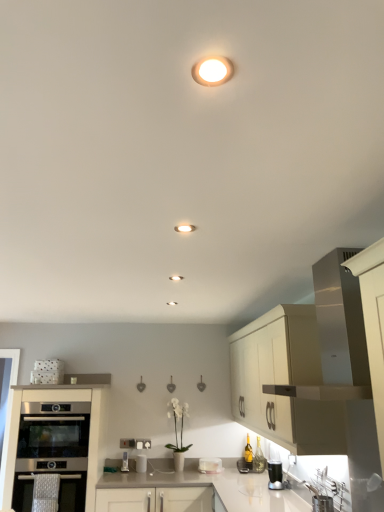
You are a GUI agent. You are given a task and a screenshot of the screen. Output one action in this format:
    pyautogui.click(x=<x>, y=<y>)
    Task: Click on the white glossy countertop at center
    
    Given the screenshot: What is the action you would take?
    pyautogui.click(x=198, y=487)

How much space does matte white light fixture at upper center, the first lighting positioned from the right, occupy vertically?

matte white light fixture at upper center, the first lighting positioned from the right, is 0.45 inches tall.

What do you see at coordinates (141, 463) in the screenshot? I see `white glossy toaster at lower center, which is the second appliance in left-to-right order` at bounding box center [141, 463].

In order to face stainless steel oven at lower left, which is the second oven in top-to-bottom order, should I rotate leftwards or rightwards?

You should look left and rotate roughly 17.743 degrees.

Measure the distance between stainless steel oven at lower left, the 1th oven from the top, and camera.

They are 3.58 meters apart.

You are a GUI agent. You are given a task and a screenshot of the screen. Output one action in this format:
    pyautogui.click(x=<x>, y=<y>)
    Task: Click on the stainless steel oven at lower left, which is the 2th oven in bottom-to-top order
    This screenshot has width=384, height=512.
    Given the screenshot: What is the action you would take?
    pyautogui.click(x=52, y=435)

What do you see at coordinates (320, 497) in the screenshot? The height and width of the screenshot is (512, 384). I see `stainless steel sink at lower right` at bounding box center [320, 497].

The height and width of the screenshot is (512, 384). I want to click on white glossy countertop at center, so click(x=198, y=487).

From the image's perspective, is translucent glass bottle at lower right over white matte cabinet at upper right, the 2th cabinetry in the left-to-right sequence?

No, from the image's perspective, translucent glass bottle at lower right is not over white matte cabinet at upper right, the 2th cabinetry in the left-to-right sequence.

Is translucent glass bottle at lower right to the left of white matte cabinet at upper right, placed as the first cabinetry when sorted from right to left, from the viewer's perspective?

Correct, you'll find translucent glass bottle at lower right to the left of white matte cabinet at upper right, placed as the first cabinetry when sorted from right to left.

From a real-world perspective, is translucent glass bottle at lower right positioned above or below white matte cabinet at upper right, the 2th cabinetry in the left-to-right sequence?

translucent glass bottle at lower right is below white matte cabinet at upper right, the 2th cabinetry in the left-to-right sequence.

Are translucent glass bottle at lower right and white matte cabinet at upper right, the 2th cabinetry in the left-to-right sequence, located far from each other?

translucent glass bottle at lower right is far away from white matte cabinet at upper right, the 2th cabinetry in the left-to-right sequence.

Does stainless steel oven at lower left, the 1th oven from the top, have a larger size compared to stainless steel sink at lower right?

Indeed, stainless steel oven at lower left, the 1th oven from the top, has a larger size compared to stainless steel sink at lower right.

You are a GUI agent. You are given a task and a screenshot of the screen. Output one action in this format:
    pyautogui.click(x=<x>, y=<y>)
    Task: Click on the sink below the stainless steel oven at lower left, which is the 2th oven in bottom-to-top order (from a real-world perspective)
    This screenshot has width=384, height=512.
    Given the screenshot: What is the action you would take?
    pyautogui.click(x=320, y=497)

Looking at their sizes, would you say stainless steel oven at lower left, which is the 2th oven in bottom-to-top order, is wider or thinner than stainless steel sink at lower right?

stainless steel oven at lower left, which is the 2th oven in bottom-to-top order, is wider than stainless steel sink at lower right.

Could you tell me if stainless steel oven at lower left, which is the 2th oven in bottom-to-top order, is facing stainless steel sink at lower right?

No, stainless steel oven at lower left, which is the 2th oven in bottom-to-top order, does not turn towards stainless steel sink at lower right.

From the image's perspective, count 1st lightings upward from the white matte cabinet at upper right, the 2th cabinetry in the left-to-right sequence, and point to it. Please provide its 2D coordinates.

[(185, 228)]

Considering the positions of objects white matte cabinet at upper right, placed as the first cabinetry when sorted from right to left, and matte white recessed light at center, positioned as the 1th lighting in bottom-to-top order, in the image provided, who is more to the right, white matte cabinet at upper right, placed as the first cabinetry when sorted from right to left, or matte white recessed light at center, positioned as the 1th lighting in bottom-to-top order,?

white matte cabinet at upper right, placed as the first cabinetry when sorted from right to left, is more to the right.

Is white matte cabinet at upper right, the 2th cabinetry in the left-to-right sequence, not near matte white recessed light at center, positioned as the 1th lighting in bottom-to-top order?

Yes, white matte cabinet at upper right, the 2th cabinetry in the left-to-right sequence, and matte white recessed light at center, positioned as the 1th lighting in bottom-to-top order, are quite far apart.

Considering the sizes of white matte cabinet at upper right, the 2th cabinetry in the left-to-right sequence, and matte white recessed light at center, which is counted as the 1th lighting, starting from the left, in the image, is white matte cabinet at upper right, the 2th cabinetry in the left-to-right sequence, wider or thinner than matte white recessed light at center, which is counted as the 1th lighting, starting from the left,?

Considering their sizes, white matte cabinet at upper right, the 2th cabinetry in the left-to-right sequence, looks broader than matte white recessed light at center, which is counted as the 1th lighting, starting from the left.

Is stainless steel oven at lower left, the 1th oven in the bottom-to-top sequence, inside the boundaries of white matte cabinet at upper right, the 2th cabinetry in the left-to-right sequence, or outside?

stainless steel oven at lower left, the 1th oven in the bottom-to-top sequence, cannot be found inside white matte cabinet at upper right, the 2th cabinetry in the left-to-right sequence.

Does stainless steel oven at lower left, which is the second oven in top-to-bottom order, turn towards white matte cabinet at upper right, placed as the first cabinetry when sorted from right to left?

No, stainless steel oven at lower left, which is the second oven in top-to-bottom order, is not facing towards white matte cabinet at upper right, placed as the first cabinetry when sorted from right to left.

Which point is more distant from viewer, (59, 489) or (322, 444)?

The point (59, 489) is farther.

Considering the relative sizes of stainless steel oven at lower left, the 1th oven in the bottom-to-top sequence, and white matte cabinet at upper right, placed as the first cabinetry when sorted from right to left, in the image provided, is stainless steel oven at lower left, the 1th oven in the bottom-to-top sequence, wider than white matte cabinet at upper right, placed as the first cabinetry when sorted from right to left,?

Yes.

From the image's perspective, does white glossy countertop at center appear higher than stainless steel sink at lower right?

No, from the image's perspective, white glossy countertop at center is not over stainless steel sink at lower right.

In terms of size, does white glossy countertop at center appear bigger or smaller than stainless steel sink at lower right?

Clearly, white glossy countertop at center is larger in size than stainless steel sink at lower right.

Is point (151, 466) closer to camera compared to point (314, 489)?

No, it is behind (314, 489).

Is stainless steel sink at lower right a part of white glossy countertop at center?

No, stainless steel sink at lower right is located outside of white glossy countertop at center.

From the picture: Does matte white light fixture at upper center, the first lighting positioned from the right, have a smaller size compared to white matte cabinet at upper right, the 2th cabinetry in the left-to-right sequence?

Indeed, matte white light fixture at upper center, the first lighting positioned from the right, has a smaller size compared to white matte cabinet at upper right, the 2th cabinetry in the left-to-right sequence.

Which of these two, matte white light fixture at upper center, which is counted as the second lighting, starting from the back, or white matte cabinet at upper right, the 2th cabinetry in the left-to-right sequence, is wider?

white matte cabinet at upper right, the 2th cabinetry in the left-to-right sequence, is wider.

Based on the photo, is matte white light fixture at upper center, which is counted as the second lighting, starting from the back, not within white matte cabinet at upper right, placed as the first cabinetry when sorted from right to left?

matte white light fixture at upper center, which is counted as the second lighting, starting from the back, is positioned outside white matte cabinet at upper right, placed as the first cabinetry when sorted from right to left.

Which of these two, matte white light fixture at upper center, marked as the 2th lighting in a left-to-right arrangement, or white matte cabinet at upper right, placed as the first cabinetry when sorted from right to left, stands shorter?

matte white light fixture at upper center, marked as the 2th lighting in a left-to-right arrangement, is shorter.

Who is shorter, white glossy toaster at lower center, which is the second appliance in left-to-right order, or matte white recessed light at center, positioned as the second lighting in right-to-left order?

matte white recessed light at center, positioned as the second lighting in right-to-left order.

Which is behind, point (139, 467) or point (185, 231)?

The point (139, 467) is farther.

From the image's perspective, is white glossy toaster at lower center, placed as the 1th appliance when sorted from right to left, below matte white recessed light at center, the 2th lighting from the top?

Correct, white glossy toaster at lower center, placed as the 1th appliance when sorted from right to left, appears lower than matte white recessed light at center, the 2th lighting from the top, in the image.

How much distance is there between white glossy toaster at lower center, placed as the 1th appliance when sorted from right to left, and matte white recessed light at center, positioned as the 1th lighting in bottom-to-top order?

white glossy toaster at lower center, placed as the 1th appliance when sorted from right to left, and matte white recessed light at center, positioned as the 1th lighting in bottom-to-top order, are 10.49 feet apart from each other.

Identify the location of bottle behind the white matte cabinet at upper right, placed as the first cabinetry when sorted from right to left. The width and height of the screenshot is (384, 512). (248, 454).

Where is `sink above the stainless steel oven at lower left, which is the 2th oven in bottom-to-top order (from the image's perspective)`? Image resolution: width=384 pixels, height=512 pixels. sink above the stainless steel oven at lower left, which is the 2th oven in bottom-to-top order (from the image's perspective) is located at coordinates (320, 497).

In the scene shown: Considering their positions, is satin silver oven at lower left, positioned as the second cabinetry in right-to-left order, positioned closer to translucent glass bottle at lower right than metallic silver toaster at lower center, arranged as the second appliance when viewed from the right?

metallic silver toaster at lower center, arranged as the second appliance when viewed from the right.

From the picture: When comparing their distances from translucent glass bottle at lower right, does stainless steel sink at lower right or white matte cabinet at upper right, the 2th cabinetry in the left-to-right sequence, seem further?

white matte cabinet at upper right, the 2th cabinetry in the left-to-right sequence.

When comparing their distances from white glossy countertop at center, does matte white light fixture at upper center, which is the 1th lighting in front-to-back order, or metallic silver toaster at lower center, marked as the 1th appliance in a left-to-right arrangement, seem closer?

metallic silver toaster at lower center, marked as the 1th appliance in a left-to-right arrangement, is closer to white glossy countertop at center.

Looking at this image, from the image, which object appears to be nearer to metallic silver toaster at lower center, arranged as the second appliance when viewed from the right, matte white light fixture at upper center, which is the 1th lighting in front-to-back order, or white glossy countertop at center?

white glossy countertop at center is positioned closer to the anchor metallic silver toaster at lower center, arranged as the second appliance when viewed from the right.

From the image, which object appears to be nearer to matte white light fixture at upper center, marked as the 2th lighting in a left-to-right arrangement, white glossy countertop at center or stainless steel oven at lower left, which is the 2th oven in bottom-to-top order?

white glossy countertop at center is closer to matte white light fixture at upper center, marked as the 2th lighting in a left-to-right arrangement.

When comparing their distances from stainless steel sink at lower right, does satin silver oven at lower left, positioned as the second cabinetry in right-to-left order, or stainless steel oven at lower left, which is the second oven in top-to-bottom order, seem further?

Among the two, satin silver oven at lower left, positioned as the second cabinetry in right-to-left order, is located further to stainless steel sink at lower right.

Looking at the image, which one is located further to stainless steel oven at lower left, which is the second oven in top-to-bottom order, matte white light fixture at upper center, which is the 1th lighting in front-to-back order, or satin silver oven at lower left, positioned as the second cabinetry in right-to-left order?

matte white light fixture at upper center, which is the 1th lighting in front-to-back order, is further to stainless steel oven at lower left, which is the second oven in top-to-bottom order.

From the image, which object appears to be farther from matte white recessed light at center, the 1th lighting when ordered from back to front, matte white light fixture at upper center, marked as the 2th lighting in a left-to-right arrangement, or satin silver oven at lower left, acting as the first cabinetry starting from the left?

satin silver oven at lower left, acting as the first cabinetry starting from the left, is further to matte white recessed light at center, the 1th lighting when ordered from back to front.

You are a GUI agent. You are given a task and a screenshot of the screen. Output one action in this format:
    pyautogui.click(x=<x>, y=<y>)
    Task: Click on the countertop between matte white recessed light at center, arranged as the 2th lighting when viewed from the front, and translucent glass bottle at lower right from front to back
    Image resolution: width=384 pixels, height=512 pixels.
    Given the screenshot: What is the action you would take?
    pyautogui.click(x=198, y=487)

At what (x,y) coordinates should I click in order to perform the action: click on lighting between matte white light fixture at upper center, the first lighting positioned from the right, and stainless steel oven at lower left, the 1th oven in the bottom-to-top sequence, from top to bottom. Please return your answer as a coordinate pair (x, y). The height and width of the screenshot is (512, 384). Looking at the image, I should click on (185, 228).

Find the location of a particular element. This screenshot has height=512, width=384. oven situated between stainless steel oven at lower left, which is the 2th oven in bottom-to-top order, and stainless steel sink at lower right from left to right is located at coordinates (72, 490).

The width and height of the screenshot is (384, 512). Find the location of `countertop positioned between matte white light fixture at upper center, positioned as the first lighting in top-to-bottom order, and metallic silver toaster at lower center, arranged as the second appliance when viewed from the right, from near to far`. countertop positioned between matte white light fixture at upper center, positioned as the first lighting in top-to-bottom order, and metallic silver toaster at lower center, arranged as the second appliance when viewed from the right, from near to far is located at coordinates (198, 487).